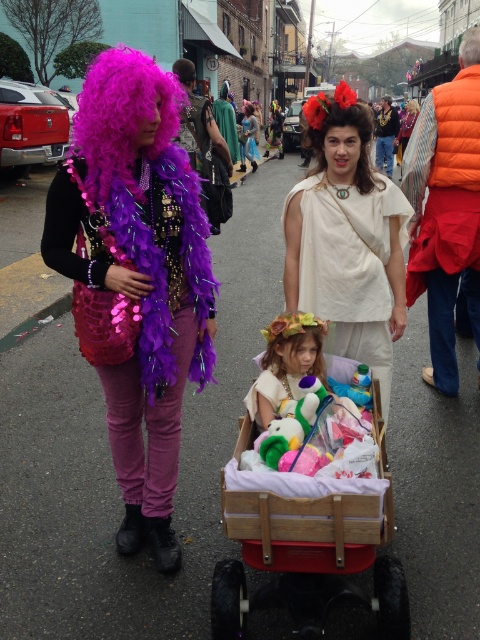
You are a photographer trying to capture both the purple feather boa at center and the fluffy purple wig at center in a single frame. Based on their sizes, which object should you focus on to ensure both fit in the photo?

The purple feather boa at center might be wider than the fluffy purple wig at center, so focusing on the purple feather boa at center would ensure both objects are captured in the frame.